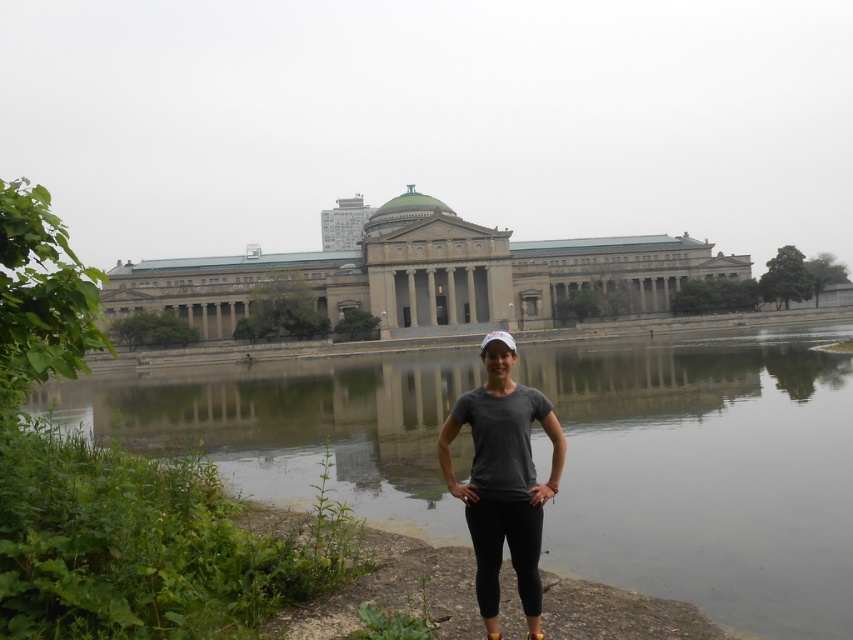
Does smooth concrete river at center have a lesser height compared to gray stone building at center?

Yes, smooth concrete river at center is shorter than gray stone building at center.

Who is more forward, (807, 529) or (206, 280)?

Point (807, 529) is more forward.

The image size is (853, 640). I want to click on smooth concrete river at center, so click(x=708, y=472).

Does point (351, 433) lie behind point (509, 548)?

Yes.

Is smooth concrete river at center behind gray matte t-shirt at center?

That is False.

What do you see at coordinates (708, 472) in the screenshot?
I see `smooth concrete river at center` at bounding box center [708, 472].

The image size is (853, 640). In order to click on smooth concrete river at center in this screenshot , I will do `click(708, 472)`.

Is gray stone building at center to the left of gray matte t-shirt at center from the viewer's perspective?

Yes, gray stone building at center is to the left of gray matte t-shirt at center.

Does point (520, 260) lie in front of point (508, 380)?

No.

The height and width of the screenshot is (640, 853). Describe the element at coordinates (425, 273) in the screenshot. I see `gray stone building at center` at that location.

Where is `gray stone building at center`? gray stone building at center is located at coordinates (425, 273).